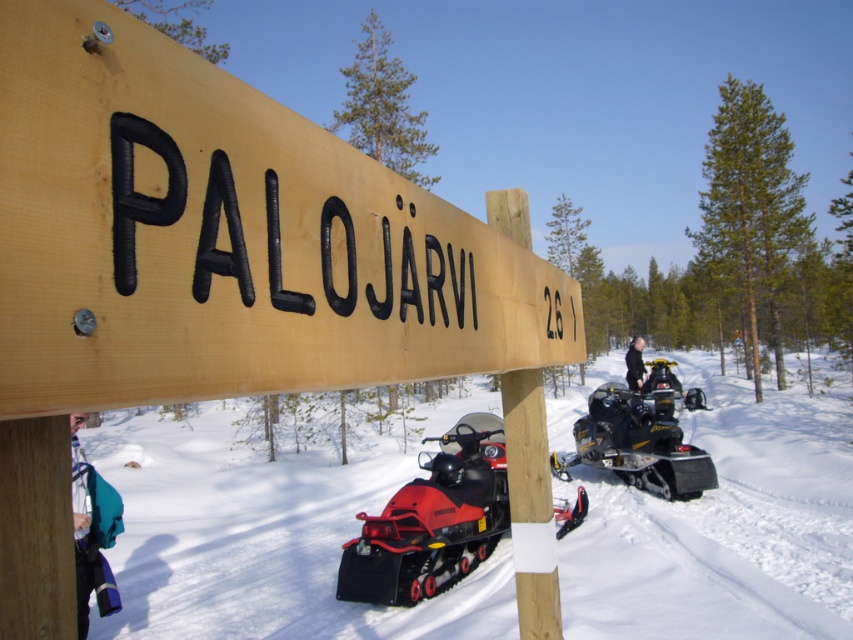
You are packing your gear for a winter trip and see the black rubber snowmobile at center and the blue fabric backpack at lower left. Which item can you place inside the other?

The blue fabric backpack at lower left can be placed inside the black rubber snowmobile at center since the snowmobile is larger in size.